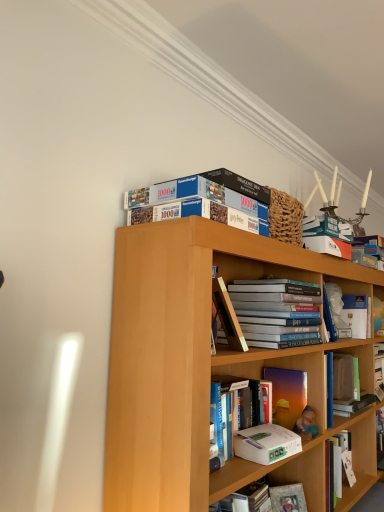
What do you see at coordinates (287, 395) in the screenshot? The width and height of the screenshot is (384, 512). I see `matte purple book at center, which is counted as the fifth book, starting from the left` at bounding box center [287, 395].

What do you see at coordinates (228, 316) in the screenshot? The width and height of the screenshot is (384, 512). I see `hardcover book at center, arranged as the 5th book when viewed from the right` at bounding box center [228, 316].

How much space does blue cardboard puzzle at upper center, marked as the 1th book in a left-to-right arrangement, occupy vertically?

4.46 inches.

What are the coordinates of `hardcover book at center, which is the fourth book from right to left` in the screenshot? It's located at (248, 400).

The height and width of the screenshot is (512, 384). What do you see at coordinates (288, 498) in the screenshot?
I see `hardcover book at lower center, arranged as the second paperback book when viewed from the front` at bounding box center [288, 498].

In order to face hardcover books at center, positioned as the fourth book in left-to-right order, should I rotate leftwards or rightwards?

Turn right approximately 11.012 degrees to face it.

Image resolution: width=384 pixels, height=512 pixels. What do you see at coordinates (277, 312) in the screenshot?
I see `hardcover books at center, positioned as the fourth book in left-to-right order` at bounding box center [277, 312].

Locate an element on the screen. This screenshot has width=384, height=512. white matte book at center-right, marked as the 6th book in a left-to-right arrangement is located at coordinates (349, 311).

This screenshot has height=512, width=384. What are the coordinates of `matte purple book at center, which is counted as the fifth book, starting from the left` in the screenshot? It's located at (287, 395).

Is hardcover book at lower center, arranged as the second paperback book when viewed from the front, taller than hardcover book at center, which ranks as the 2th book in left-to-right order?

No, hardcover book at lower center, arranged as the second paperback book when viewed from the front, is not taller than hardcover book at center, which ranks as the 2th book in left-to-right order.

Does hardcover book at lower center, acting as the first paperback book starting from the bottom, touch hardcover book at center, arranged as the 5th book when viewed from the right?

No.

Considering the sizes of objects hardcover book at lower center, arranged as the second paperback book when viewed from the front, and hardcover book at center, arranged as the 5th book when viewed from the right, in the image provided, who is smaller, hardcover book at lower center, arranged as the second paperback book when viewed from the front, or hardcover book at center, arranged as the 5th book when viewed from the right,?

hardcover book at lower center, arranged as the second paperback book when viewed from the front, is smaller.

Which object is thinner, hardcover book at lower center, arranged as the second paperback book when viewed from the front, or hardcover book at center, arranged as the 5th book when viewed from the right?

Thinner between the two is hardcover book at lower center, arranged as the second paperback book when viewed from the front.

Which is in front, point (254, 423) or point (299, 319)?

Point (254, 423)

From a real-world perspective, is hardcover book at center, positioned as the 3th book in left-to-right order, physically below hardcover books at center, positioned as the fourth book in left-to-right order?

Yes, from a real-world perspective, hardcover book at center, positioned as the 3th book in left-to-right order, is under hardcover books at center, positioned as the fourth book in left-to-right order.

From the picture: From the image's perspective, is hardcover book at center, positioned as the 3th book in left-to-right order, beneath hardcover books at center, positioned as the fourth book in left-to-right order?

Indeed, from the image's perspective, hardcover book at center, positioned as the 3th book in left-to-right order, is shown beneath hardcover books at center, positioned as the fourth book in left-to-right order.

From a real-world perspective, is white matte paperback book at center, which is the second paperback book in back-to-front order, beneath matte purple book at center, which appears as the second book when viewed from the right?

Yes, from a real-world perspective, white matte paperback book at center, which is the second paperback book in back-to-front order, is below matte purple book at center, which appears as the second book when viewed from the right.

In the scene shown: Which is correct: white matte paperback book at center, the first paperback book positioned from the top, is inside matte purple book at center, which appears as the second book when viewed from the right, or outside of it?

white matte paperback book at center, the first paperback book positioned from the top, is located beyond the bounds of matte purple book at center, which appears as the second book when viewed from the right.

The height and width of the screenshot is (512, 384). I want to click on the 2nd book to the right of the white matte paperback book at center, the 1th paperback book viewed from the front, counting from the anchor's position, so click(x=287, y=395).

From the image's perspective, which one is positioned lower, white matte paperback book at center, which is the second paperback book in back-to-front order, or matte purple book at center, which is counted as the fifth book, starting from the left?

A: white matte paperback book at center, which is the second paperback book in back-to-front order.

Is point (243, 349) closer or farther from the camera than point (268, 284)?

Clearly, point (243, 349) is closer to the camera than point (268, 284).

From a real-world perspective, is hardcover book at center, arranged as the 5th book when viewed from the right, physically below hardcover books at center, arranged as the 3th book when viewed from the right?

Correct, in the physical world, hardcover book at center, arranged as the 5th book when viewed from the right, is lower than hardcover books at center, arranged as the 3th book when viewed from the right.

From the image's perspective, is hardcover book at center, arranged as the 5th book when viewed from the right, below hardcover books at center, arranged as the 3th book when viewed from the right?

Incorrect, from the image's perspective, hardcover book at center, arranged as the 5th book when viewed from the right, is higher than hardcover books at center, arranged as the 3th book when viewed from the right.

Based on the photo, from the image's perspective, is hardcover books at center, arranged as the 3th book when viewed from the right, under hardcover book at center, which is the fourth book from right to left?

No, from the image's perspective, hardcover books at center, arranged as the 3th book when viewed from the right, is not below hardcover book at center, which is the fourth book from right to left.

From a real-world perspective, is hardcover books at center, arranged as the 3th book when viewed from the right, on hardcover book at center, positioned as the 3th book in left-to-right order?

Yes.

Considering the sizes of hardcover books at center, arranged as the 3th book when viewed from the right, and hardcover book at center, positioned as the 3th book in left-to-right order, in the image, is hardcover books at center, arranged as the 3th book when viewed from the right, taller or shorter than hardcover book at center, positioned as the 3th book in left-to-right order,?

hardcover books at center, arranged as the 3th book when viewed from the right, is taller than hardcover book at center, positioned as the 3th book in left-to-right order.

Looking at this image, is hardcover books at center, positioned as the fourth book in left-to-right order, behind hardcover book at center, which is the fourth book from right to left?

Yes.

Between hardcover book at center, which ranks as the 2th book in left-to-right order, and white matte book at center-right, which appears as the first book when viewed from the right, which one is positioned behind?

white matte book at center-right, which appears as the first book when viewed from the right, is further from the camera.

Who is taller, hardcover book at center, which ranks as the 2th book in left-to-right order, or white matte book at center-right, which appears as the first book when viewed from the right?

hardcover book at center, which ranks as the 2th book in left-to-right order, is taller.

From the image's perspective, does hardcover book at center, which ranks as the 2th book in left-to-right order, appear higher than white matte book at center-right, marked as the 6th book in a left-to-right arrangement?

Correct, hardcover book at center, which ranks as the 2th book in left-to-right order, appears higher than white matte book at center-right, marked as the 6th book in a left-to-right arrangement, in the image.

Is hardcover book at lower center, the 2th paperback book from the top, completely or partially outside of hardcover books at center, arranged as the 3th book when viewed from the right?

hardcover book at lower center, the 2th paperback book from the top, is positioned outside hardcover books at center, arranged as the 3th book when viewed from the right.

Which is behind, point (295, 493) or point (259, 340)?

The point (295, 493) is farther.

Does hardcover book at lower center, acting as the first paperback book starting from the bottom, have a lesser width compared to hardcover books at center, positioned as the fourth book in left-to-right order?

Yes, hardcover book at lower center, acting as the first paperback book starting from the bottom, is thinner than hardcover books at center, positioned as the fourth book in left-to-right order.

Between hardcover book at lower center, the 2th paperback book from the top, and hardcover books at center, arranged as the 3th book when viewed from the right, which one has more height?

With more height is hardcover books at center, arranged as the 3th book when viewed from the right.

From the image's perspective, starting from the hardcover book at lower center, arranged as the second paperback book when viewed from the front, which book is the 5th one above? Please provide its 2D coordinates.

[(228, 316)]

Locate an element on the screen. The image size is (384, 512). the 1st book in front of the hardcover books at center, positioned as the fourth book in left-to-right order, starting your count from the anchor is located at coordinates (248, 400).

Which object lies further to the anchor point white matte book at center-right, which appears as the first book when viewed from the right, blue cardboard puzzle at upper center, arranged as the sixth book when viewed from the right, or hardcover book at center, which is the fourth book from right to left?

blue cardboard puzzle at upper center, arranged as the sixth book when viewed from the right, is positioned further to the anchor white matte book at center-right, which appears as the first book when viewed from the right.

Consider the image. Looking at the image, which one is located further to matte purple book at center, which is counted as the fifth book, starting from the left, white matte paperback book at center, the first paperback book positioned from the top, or hardcover books at center, arranged as the 3th book when viewed from the right?

hardcover books at center, arranged as the 3th book when viewed from the right, is positioned further to the anchor matte purple book at center, which is counted as the fifth book, starting from the left.

Considering their positions, is white matte book at center-right, which appears as the first book when viewed from the right, positioned closer to matte purple book at center, which is counted as the fifth book, starting from the left, than white matte paperback book at center, which is the second paperback book in back-to-front order?

white matte paperback book at center, which is the second paperback book in back-to-front order.

Based on their spatial positions, is white matte paperback book at center, which is the second paperback book in back-to-front order, or hardcover book at center, which is the fourth book from right to left, further from hardcover book at lower center, acting as the first paperback book starting from the bottom?

hardcover book at center, which is the fourth book from right to left, is further to hardcover book at lower center, acting as the first paperback book starting from the bottom.

Looking at this image, considering their positions, is hardcover book at center, positioned as the 3th book in left-to-right order, positioned closer to hardcover book at center, which ranks as the 2th book in left-to-right order, than blue cardboard puzzle at upper center, arranged as the sixth book when viewed from the right?

The object closer to hardcover book at center, which ranks as the 2th book in left-to-right order, is hardcover book at center, positioned as the 3th book in left-to-right order.

Which object lies further to the anchor point hardcover book at center, which is the fourth book from right to left, hardcover books at center, arranged as the 3th book when viewed from the right, or blue cardboard puzzle at upper center, arranged as the sixth book when viewed from the right?

Among the two, blue cardboard puzzle at upper center, arranged as the sixth book when viewed from the right, is located further to hardcover book at center, which is the fourth book from right to left.

Which object lies further to the anchor point hardcover books at center, arranged as the 3th book when viewed from the right, blue cardboard puzzle at upper center, marked as the 1th book in a left-to-right arrangement, or hardcover book at lower center, acting as the first paperback book starting from the bottom?

Among the two, hardcover book at lower center, acting as the first paperback book starting from the bottom, is located further to hardcover books at center, arranged as the 3th book when viewed from the right.

Based on their spatial positions, is blue cardboard puzzle at upper center, arranged as the sixth book when viewed from the right, or hardcover book at center, arranged as the 5th book when viewed from the right, closer to matte purple book at center, which is counted as the fifth book, starting from the left?

Based on the image, hardcover book at center, arranged as the 5th book when viewed from the right, appears to be nearer to matte purple book at center, which is counted as the fifth book, starting from the left.

The width and height of the screenshot is (384, 512). Identify the location of paperback book between hardcover book at center, which is the fourth book from right to left, and hardcover book at lower center, acting as the first paperback book starting from the bottom, in the up-down direction. (266, 443).

You are a GUI agent. You are given a task and a screenshot of the screen. Output one action in this format:
    pyautogui.click(x=<x>, y=<y>)
    Task: Click on the book between blue cardboard puzzle at upper center, arranged as the sixth book when viewed from the right, and hardcover books at center, positioned as the fourth book in left-to-right order, from top to bottom
    The height and width of the screenshot is (512, 384).
    Given the screenshot: What is the action you would take?
    pyautogui.click(x=228, y=316)

Image resolution: width=384 pixels, height=512 pixels. Find the location of `paperback book between blue cardboard puzzle at upper center, arranged as the sixth book when viewed from the right, and hardcover book at lower center, the 2th paperback book from the top, in the vertical direction`. paperback book between blue cardboard puzzle at upper center, arranged as the sixth book when viewed from the right, and hardcover book at lower center, the 2th paperback book from the top, in the vertical direction is located at coordinates (266, 443).

The width and height of the screenshot is (384, 512). Identify the location of paperback book between white matte paperback book at center, the 1th paperback book viewed from the front, and white matte book at center-right, which appears as the first book when viewed from the right, along the z-axis. (288, 498).